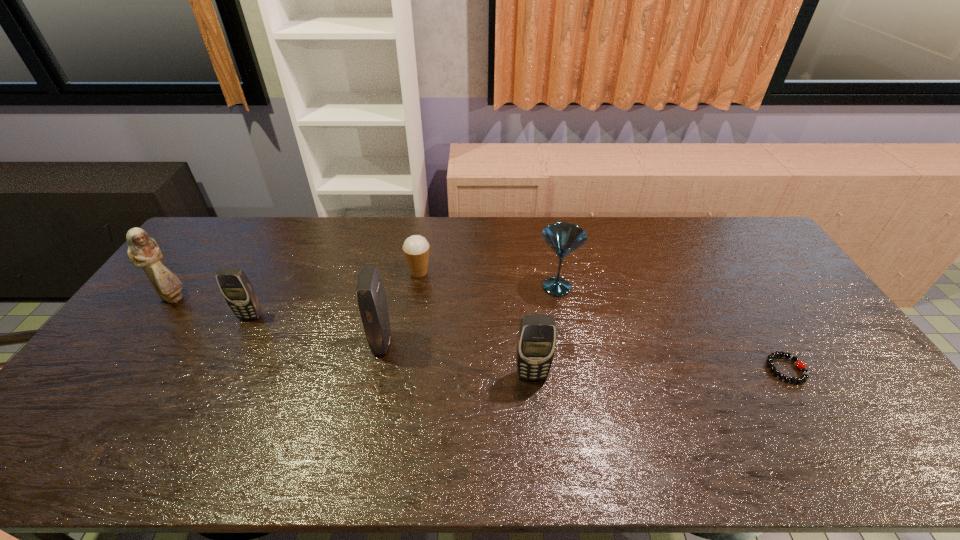
Please point a vacant point for placing a cellular telephone on the right. Please provide its 2D coordinates. Your answer should be formatted as a tuple, i.e. [(x, y)], where the tuple contains the x and y coordinates of a point satisfying the conditions above.

[(703, 411)]